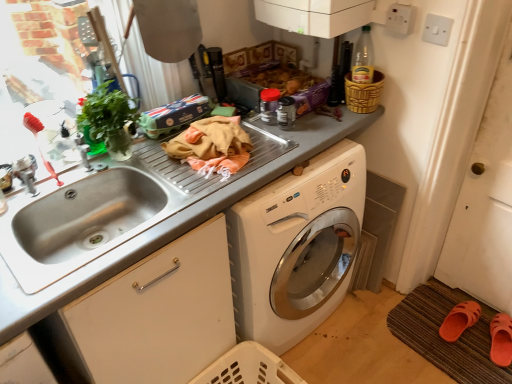
Question: Considering the relative sizes of green leafy plant at left and white plastic switch at upper right, the 1th electric outlet when ordered from right to left, in the image provided, is green leafy plant at left shorter than white plastic switch at upper right, the 1th electric outlet when ordered from right to left,?

Choices:
 (A) no
 (B) yes

Answer: (A)

Question: From the image's perspective, is green leafy plant at left above white plastic switch at upper right, the 1th electric outlet when ordered from right to left?

Choices:
 (A) yes
 (B) no

Answer: (B)

Question: Considering the relative positions of green leafy plant at left and white plastic switch at upper right, the 1th electric outlet when ordered from right to left, in the image provided, is green leafy plant at left in front of white plastic switch at upper right, the 1th electric outlet when ordered from right to left,?

Choices:
 (A) no
 (B) yes

Answer: (B)

Question: From the image's perspective, is green leafy plant at left beneath white plastic switch at upper right, which is the 2th electric outlet from left to right?

Choices:
 (A) no
 (B) yes

Answer: (B)

Question: Can you confirm if green leafy plant at left is positioned to the left of white plastic switch at upper right, the 1th electric outlet when ordered from right to left?

Choices:
 (A) yes
 (B) no

Answer: (A)

Question: Is green leafy plant at left completely or partially outside of white plastic switch at upper right, the 1th electric outlet when ordered from right to left?

Choices:
 (A) no
 (B) yes

Answer: (B)

Question: Can you confirm if white plastic electric outlet at upper right, acting as the 1th electric outlet starting from the left, is bigger than brown woven mat at lower right?

Choices:
 (A) yes
 (B) no

Answer: (B)

Question: Is white plastic electric outlet at upper right, acting as the 1th electric outlet starting from the left, at the left side of brown woven mat at lower right?

Choices:
 (A) no
 (B) yes

Answer: (B)

Question: From a real-world perspective, is white plastic electric outlet at upper right, acting as the 1th electric outlet starting from the left, beneath brown woven mat at lower right?

Choices:
 (A) no
 (B) yes

Answer: (A)

Question: Is white plastic electric outlet at upper right, marked as the second electric outlet in a right-to-left arrangement, positioned beyond the bounds of brown woven mat at lower right?

Choices:
 (A) no
 (B) yes

Answer: (B)

Question: Is white plastic electric outlet at upper right, acting as the 1th electric outlet starting from the left, positioned behind brown woven mat at lower right?

Choices:
 (A) no
 (B) yes

Answer: (A)

Question: Considering the relative positions of white plastic electric outlet at upper right, marked as the second electric outlet in a right-to-left arrangement, and brown woven mat at lower right in the image provided, is white plastic electric outlet at upper right, marked as the second electric outlet in a right-to-left arrangement, to the right of brown woven mat at lower right from the viewer's perspective?

Choices:
 (A) no
 (B) yes

Answer: (A)

Question: Can green leafy plant at left be found inside brown woven mat at lower right?

Choices:
 (A) yes
 (B) no

Answer: (B)